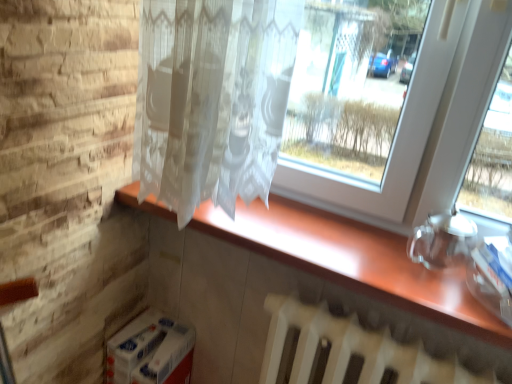
Describe the element at coordinates (353, 260) in the screenshot. I see `wooden counter at center` at that location.

In order to face wooden counter at center, should I rotate leftwards or rightwards?

To face it directly, rotate right by 6.880 degrees.

This screenshot has height=384, width=512. I want to click on wooden counter at center, so click(353, 260).

Locate an element on the screen. white matte radiator at lower center is located at coordinates (350, 349).

What do you see at coordinates (350, 349) in the screenshot? I see `white matte radiator at lower center` at bounding box center [350, 349].

This screenshot has width=512, height=384. I want to click on wooden counter at center, so click(353, 260).

Which object is positioned more to the left, wooden counter at center or white matte radiator at lower center?

From the viewer's perspective, wooden counter at center appears more on the left side.

Is wooden counter at center further to camera compared to white matte radiator at lower center?

Yes, wooden counter at center is further from the camera.

Between point (288, 255) and point (337, 367), which one is positioned behind?

Point (337, 367)

From the image's perspective, would you say wooden counter at center is positioned over white matte radiator at lower center?

Yes, from the image's perspective, wooden counter at center is on top of white matte radiator at lower center.

From a real-world perspective, which is physically below, wooden counter at center or white matte radiator at lower center?

white matte radiator at lower center.

Between wooden counter at center and white matte radiator at lower center, which one has larger width?

With larger width is wooden counter at center.

Does wooden counter at center have a greater height compared to white matte radiator at lower center?

No, wooden counter at center is not taller than white matte radiator at lower center.

Considering the relative sizes of wooden counter at center and white matte radiator at lower center in the image provided, is wooden counter at center bigger than white matte radiator at lower center?

No.

Which is correct: wooden counter at center is inside white matte radiator at lower center, or outside of it?

wooden counter at center cannot be found inside white matte radiator at lower center.

Is wooden counter at center touching white matte radiator at lower center?

wooden counter at center and white matte radiator at lower center are clearly separated.

Does wooden counter at center turn towards white matte radiator at lower center?

No, wooden counter at center is not aimed at white matte radiator at lower center.

What are the coordinates of `radiator that is on the right side of wooden counter at center` in the screenshot? It's located at (350, 349).

Between white matte radiator at lower center and wooden counter at center, which one appears on the right side from the viewer's perspective?

white matte radiator at lower center is more to the right.

Considering their positions, is white matte radiator at lower center located in front of or behind wooden counter at center?

In the image, white matte radiator at lower center appears in front of wooden counter at center.

In the scene shown: Which is less distant, (335, 335) or (294, 223)?

Point (335, 335)

From the image's perspective, is white matte radiator at lower center on top of wooden counter at center?

No.

From a real-world perspective, who is located higher, white matte radiator at lower center or wooden counter at center?

wooden counter at center is physically above.

Which object is thinner, white matte radiator at lower center or wooden counter at center?

With smaller width is white matte radiator at lower center.

In the scene shown: Who is shorter, white matte radiator at lower center or wooden counter at center?

With less height is wooden counter at center.

Considering the sizes of objects white matte radiator at lower center and wooden counter at center in the image provided, who is bigger, white matte radiator at lower center or wooden counter at center?

white matte radiator at lower center is bigger.

Is white matte radiator at lower center outside of wooden counter at center?

white matte radiator at lower center is positioned outside wooden counter at center.

Is white matte radiator at lower center not close to wooden counter at center?

white matte radiator at lower center is actually quite close to wooden counter at center.

Is white matte radiator at lower center oriented away from wooden counter at center?

No, white matte radiator at lower center's orientation is not away from wooden counter at center.

Based on the photo, how different are the orientations of white matte radiator at lower center and wooden counter at center in degrees?

0.213 degrees separate the facing orientations of white matte radiator at lower center and wooden counter at center.

Find the location of a particular element. The height and width of the screenshot is (384, 512). counter top above the white matte radiator at lower center (from a real-world perspective) is located at coordinates (353, 260).

The width and height of the screenshot is (512, 384). Find the location of `counter top above the white matte radiator at lower center (from a real-world perspective)`. counter top above the white matte radiator at lower center (from a real-world perspective) is located at coordinates (353, 260).

I want to click on radiator to the right of wooden counter at center, so (350, 349).